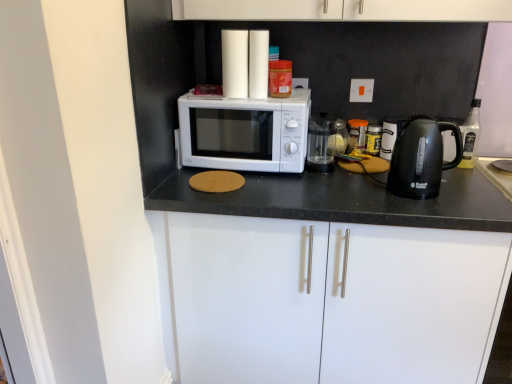
Question: From a real-world perspective, is black plastic kettle at right located beneath transparent glass coffee maker at center?

Choices:
 (A) no
 (B) yes

Answer: (A)

Question: Is black plastic kettle at right positioned with its back to transparent glass coffee maker at center?

Choices:
 (A) yes
 (B) no

Answer: (B)

Question: Is black plastic kettle at right not inside transparent glass coffee maker at center?

Choices:
 (A) no
 (B) yes

Answer: (B)

Question: Does black plastic kettle at right have a lesser height compared to transparent glass coffee maker at center?

Choices:
 (A) no
 (B) yes

Answer: (A)

Question: Is transparent glass coffee maker at center located within black plastic kettle at right?

Choices:
 (A) no
 (B) yes

Answer: (A)

Question: From a real-world perspective, is black plastic kettle at right positioned over transparent glass coffee maker at center based on gravity?

Choices:
 (A) no
 (B) yes

Answer: (B)

Question: Is transparent glass coffee maker at center looking in the opposite direction of white matte cabinet at center, which is the 1th cabinetry from bottom to top?

Choices:
 (A) yes
 (B) no

Answer: (B)

Question: Is transparent glass coffee maker at center surrounding white matte cabinet at center, which is the 1th cabinetry from bottom to top?

Choices:
 (A) yes
 (B) no

Answer: (B)

Question: Is transparent glass coffee maker at center positioned before white matte cabinet at center, which is the second cabinetry from top to bottom?

Choices:
 (A) no
 (B) yes

Answer: (A)

Question: From the image's perspective, does transparent glass coffee maker at center appear higher than white matte cabinet at center, which is the second cabinetry from top to bottom?

Choices:
 (A) yes
 (B) no

Answer: (A)

Question: Is transparent glass coffee maker at center directly adjacent to white matte cabinet at center, which is the second cabinetry from top to bottom?

Choices:
 (A) yes
 (B) no

Answer: (B)

Question: Considering the relative sizes of transparent glass coffee maker at center and white matte cabinet at center, which is the 1th cabinetry from bottom to top, in the image provided, is transparent glass coffee maker at center wider than white matte cabinet at center, which is the 1th cabinetry from bottom to top,?

Choices:
 (A) no
 (B) yes

Answer: (A)

Question: Can you confirm if white matte microwave at center is wider than white matte cabinet at center, which is the 1th cabinetry from bottom to top?

Choices:
 (A) no
 (B) yes

Answer: (A)